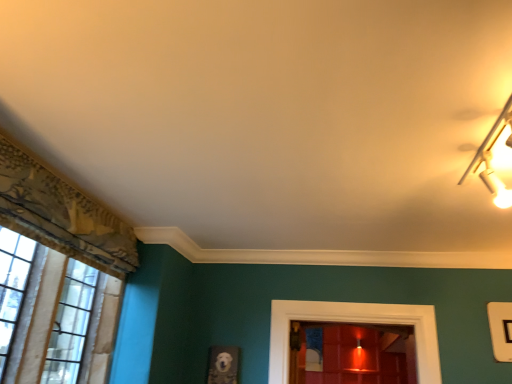
Question: Is metallic gold light fixture at upper right oriented away from white textured curtain at left?

Choices:
 (A) no
 (B) yes

Answer: (A)

Question: Is metallic gold light fixture at upper right at the right side of white textured curtain at left?

Choices:
 (A) yes
 (B) no

Answer: (A)

Question: Can you confirm if metallic gold light fixture at upper right is thinner than white textured curtain at left?

Choices:
 (A) yes
 (B) no

Answer: (B)

Question: Is metallic gold light fixture at upper right touching white textured curtain at left?

Choices:
 (A) yes
 (B) no

Answer: (B)

Question: Is metallic gold light fixture at upper right located outside white textured curtain at left?

Choices:
 (A) yes
 (B) no

Answer: (A)

Question: Considering the relative sizes of metallic gold light fixture at upper right and white textured curtain at left in the image provided, is metallic gold light fixture at upper right taller than white textured curtain at left?

Choices:
 (A) no
 (B) yes

Answer: (A)

Question: Is white textured curtain at left looking in the opposite direction of metallic gold light fixture at upper right?

Choices:
 (A) no
 (B) yes

Answer: (A)

Question: From the image's perspective, is white textured curtain at left over metallic gold light fixture at upper right?

Choices:
 (A) yes
 (B) no

Answer: (B)

Question: Is white textured curtain at left shorter than metallic gold light fixture at upper right?

Choices:
 (A) yes
 (B) no

Answer: (B)

Question: Does white textured curtain at left have a lesser width compared to metallic gold light fixture at upper right?

Choices:
 (A) yes
 (B) no

Answer: (A)

Question: Is white textured curtain at left beside metallic gold light fixture at upper right?

Choices:
 (A) no
 (B) yes

Answer: (A)

Question: Considering the relative sizes of white textured curtain at left and metallic gold light fixture at upper right in the image provided, is white textured curtain at left smaller than metallic gold light fixture at upper right?

Choices:
 (A) no
 (B) yes

Answer: (A)

Question: Is white textured curtain at left taller or shorter than metallic gold light fixture at upper right?

Choices:
 (A) short
 (B) tall

Answer: (B)